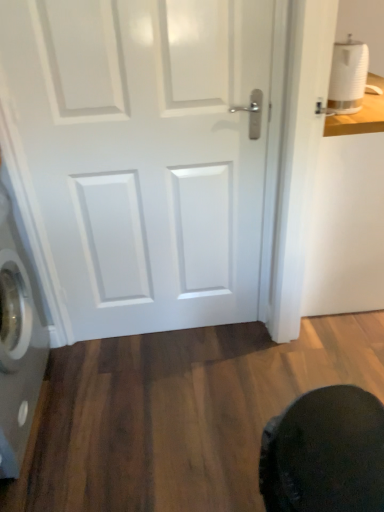
Question: From a real-world perspective, does silver metallic washing machine at left sit lower than dark fabric swivel chair at lower right?

Choices:
 (A) no
 (B) yes

Answer: (A)

Question: Is silver metallic washing machine at left placed right next to dark fabric swivel chair at lower right?

Choices:
 (A) yes
 (B) no

Answer: (B)

Question: From the image's perspective, is silver metallic washing machine at left on dark fabric swivel chair at lower right?

Choices:
 (A) yes
 (B) no

Answer: (A)

Question: Is silver metallic washing machine at left positioned in front of dark fabric swivel chair at lower right?

Choices:
 (A) no
 (B) yes

Answer: (A)

Question: Could you tell me if silver metallic washing machine at left is facing dark fabric swivel chair at lower right?

Choices:
 (A) yes
 (B) no

Answer: (B)

Question: Would you say white glossy door at center is to the left or to the right of silver metallic washing machine at left in the picture?

Choices:
 (A) left
 (B) right

Answer: (B)

Question: Considering the positions of white glossy door at center and silver metallic washing machine at left in the image, is white glossy door at center taller or shorter than silver metallic washing machine at left?

Choices:
 (A) short
 (B) tall

Answer: (B)

Question: Considering their positions, is white glossy door at center located in front of or behind silver metallic washing machine at left?

Choices:
 (A) behind
 (B) front

Answer: (A)

Question: Would you say white glossy door at center is inside or outside silver metallic washing machine at left?

Choices:
 (A) inside
 (B) outside

Answer: (B)

Question: Considering the positions of dark fabric swivel chair at lower right and white matte toilet paper at upper right in the image, is dark fabric swivel chair at lower right bigger or smaller than white matte toilet paper at upper right?

Choices:
 (A) big
 (B) small

Answer: (A)

Question: From the image's perspective, is dark fabric swivel chair at lower right located above or below white matte toilet paper at upper right?

Choices:
 (A) below
 (B) above

Answer: (A)

Question: Is dark fabric swivel chair at lower right in front of or behind white matte toilet paper at upper right in the image?

Choices:
 (A) front
 (B) behind

Answer: (A)

Question: In terms of width, does dark fabric swivel chair at lower right look wider or thinner when compared to white matte toilet paper at upper right?

Choices:
 (A) wide
 (B) thin

Answer: (A)

Question: From the image's perspective, is silver metallic washing machine at left located above or below white glossy door at center?

Choices:
 (A) below
 (B) above

Answer: (A)

Question: From their relative heights in the image, would you say silver metallic washing machine at left is taller or shorter than white glossy door at center?

Choices:
 (A) tall
 (B) short

Answer: (B)